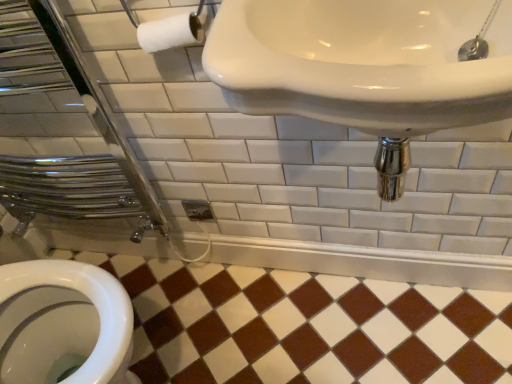
The height and width of the screenshot is (384, 512). Describe the element at coordinates (364, 68) in the screenshot. I see `white glossy sink at upper center` at that location.

Locate an element on the screen. The image size is (512, 384). white glossy sink at upper center is located at coordinates (364, 68).

Measure the distance between point (214, 70) and camera.

The distance of point (214, 70) from camera is 18.62 inches.

What is the approximate width of white glossy sink at upper center?

white glossy sink at upper center is 14.24 inches wide.

The image size is (512, 384). Find the location of `white glossy sink at upper center`. white glossy sink at upper center is located at coordinates (364, 68).